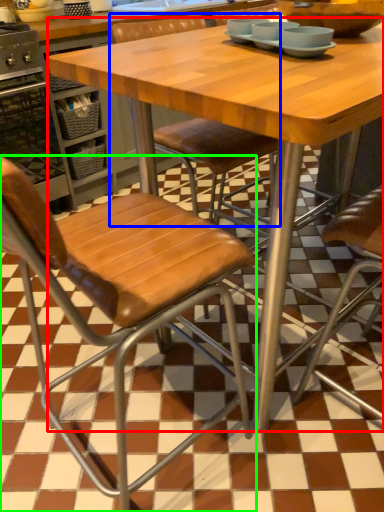
Question: Which object is positioned closest to table (highlighted by a red box)? Select from chair (highlighted by a blue box) and chair (highlighted by a green box).

Choices:
 (A) chair
 (B) chair

Answer: (B)